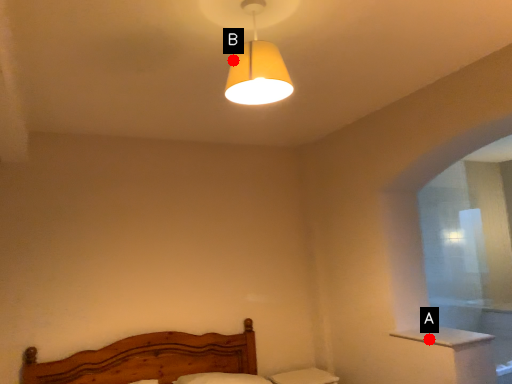
Question: Two points are circled on the image, labeled by A and B beside each circle. Which point is closer to the camera?

Choices:
 (A) A is closer
 (B) B is closer

Answer: (B)